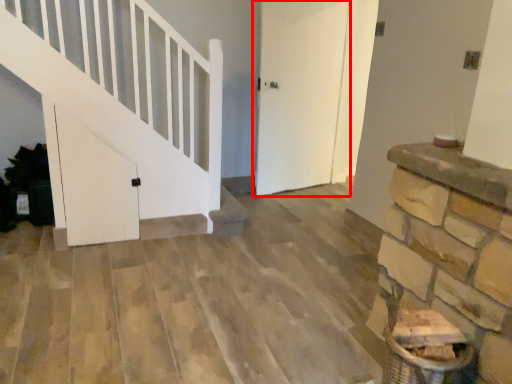
Question: From the image's perspective, what is the correct spatial relationship of door (annotated by the red box) in relation to door?

Choices:
 (A) above
 (B) below

Answer: (A)